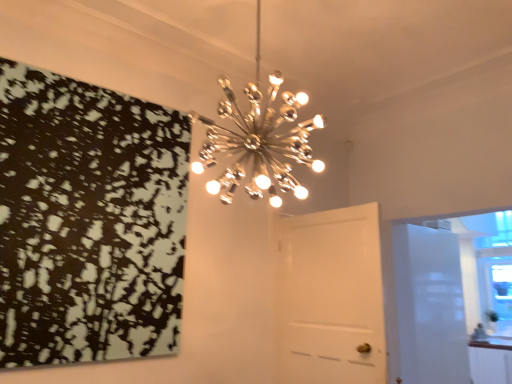
Question: Does black matte print at upper left contain white glossy door at right, the 2th door when ordered from front to back?

Choices:
 (A) no
 (B) yes

Answer: (A)

Question: Is black matte print at upper left closer to camera compared to white glossy door at right, the 2th door when ordered from front to back?

Choices:
 (A) no
 (B) yes

Answer: (B)

Question: Can you confirm if black matte print at upper left is wider than white glossy door at right, the first door positioned from the right?

Choices:
 (A) no
 (B) yes

Answer: (A)

Question: Does black matte print at upper left turn towards white glossy door at right, the first door positioned from the right?

Choices:
 (A) yes
 (B) no

Answer: (B)

Question: From the image's perspective, is black matte print at upper left below white glossy door at right, which is the first door in back-to-front order?

Choices:
 (A) yes
 (B) no

Answer: (B)

Question: Is black matte print at upper left behind white glossy door at right, the 2th door when ordered from front to back?

Choices:
 (A) no
 (B) yes

Answer: (A)

Question: From a real-world perspective, is white glossy cabinetry at lower right physically above metallic starburst chandelier at upper center?

Choices:
 (A) no
 (B) yes

Answer: (A)

Question: From the image's perspective, is white glossy cabinetry at lower right above metallic starburst chandelier at upper center?

Choices:
 (A) no
 (B) yes

Answer: (A)

Question: From a real-world perspective, is white glossy cabinetry at lower right beneath metallic starburst chandelier at upper center?

Choices:
 (A) yes
 (B) no

Answer: (A)

Question: Is white glossy cabinetry at lower right bigger than metallic starburst chandelier at upper center?

Choices:
 (A) yes
 (B) no

Answer: (B)

Question: Is white glossy cabinetry at lower right taller than metallic starburst chandelier at upper center?

Choices:
 (A) yes
 (B) no

Answer: (B)

Question: Does white glossy cabinetry at lower right come behind metallic starburst chandelier at upper center?

Choices:
 (A) yes
 (B) no

Answer: (A)

Question: Does metallic starburst chandelier at upper center have a lesser height compared to white glossy door at right, the first door positioned from the right?

Choices:
 (A) yes
 (B) no

Answer: (A)